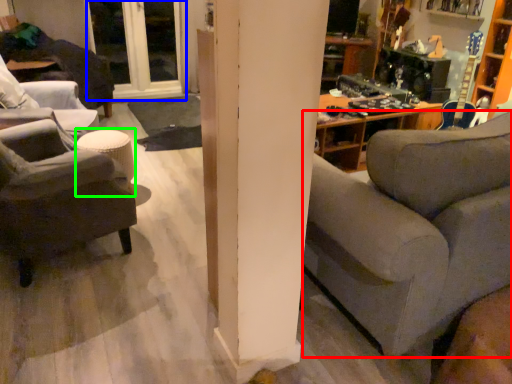
Question: Which is nearer to the studio couch (highlighted by a red box)? window (highlighted by a blue box) or stool (highlighted by a green box).

Choices:
 (A) window
 (B) stool

Answer: (B)